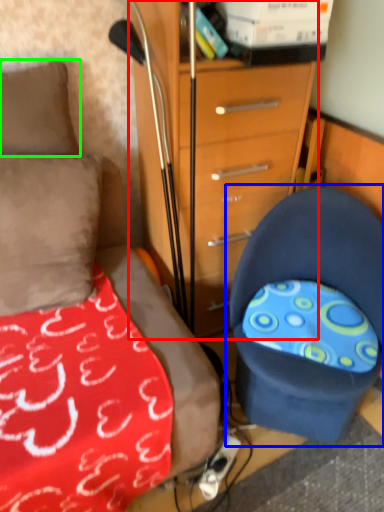
Question: Which object is the farthest from chest of drawers (highlighted by a red box)? Choose among these: chair (highlighted by a blue box) or pillow (highlighted by a green box).

Choices:
 (A) chair
 (B) pillow

Answer: (B)